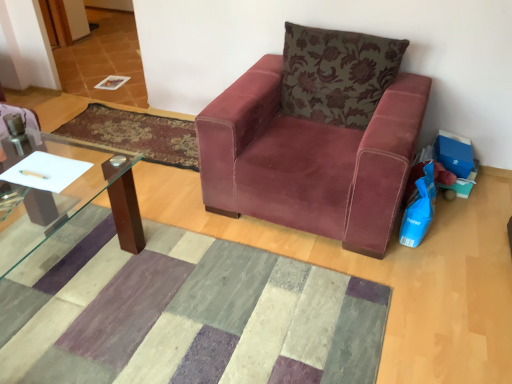
Question: Is floral-patterned velvet pillow at upper right far from metallic silver pen at lower left?

Choices:
 (A) yes
 (B) no

Answer: (A)

Question: From a real-world perspective, is floral-patterned velvet pillow at upper right on top of metallic silver pen at lower left?

Choices:
 (A) yes
 (B) no

Answer: (A)

Question: From a real-world perspective, is floral-patterned velvet pillow at upper right below metallic silver pen at lower left?

Choices:
 (A) no
 (B) yes

Answer: (A)

Question: Does floral-patterned velvet pillow at upper right have a greater width compared to metallic silver pen at lower left?

Choices:
 (A) yes
 (B) no

Answer: (A)

Question: Considering the relative sizes of floral-patterned velvet pillow at upper right and metallic silver pen at lower left in the image provided, is floral-patterned velvet pillow at upper right smaller than metallic silver pen at lower left?

Choices:
 (A) no
 (B) yes

Answer: (A)

Question: Considering the relative positions of floral-patterned velvet pillow at upper right and metallic silver pen at lower left in the image provided, is floral-patterned velvet pillow at upper right to the right of metallic silver pen at lower left from the viewer's perspective?

Choices:
 (A) yes
 (B) no

Answer: (A)

Question: Is floral-patterned velvet pillow at upper right looking in the opposite direction of velvet maroon armchair at center?

Choices:
 (A) no
 (B) yes

Answer: (B)

Question: Can you confirm if floral-patterned velvet pillow at upper right is positioned to the left of velvet maroon armchair at center?

Choices:
 (A) no
 (B) yes

Answer: (A)

Question: Does floral-patterned velvet pillow at upper right have a smaller size compared to velvet maroon armchair at center?

Choices:
 (A) no
 (B) yes

Answer: (B)

Question: From a real-world perspective, does floral-patterned velvet pillow at upper right stand above velvet maroon armchair at center?

Choices:
 (A) no
 (B) yes

Answer: (B)

Question: Does floral-patterned velvet pillow at upper right have a lesser width compared to velvet maroon armchair at center?

Choices:
 (A) no
 (B) yes

Answer: (B)

Question: Does floral-patterned velvet pillow at upper right have a greater width compared to velvet maroon armchair at center?

Choices:
 (A) no
 (B) yes

Answer: (A)

Question: From a real-world perspective, is velvet-like burgundy mat at center, the 2th mat ordered from the bottom, on metallic silver pen at lower left?

Choices:
 (A) yes
 (B) no

Answer: (B)